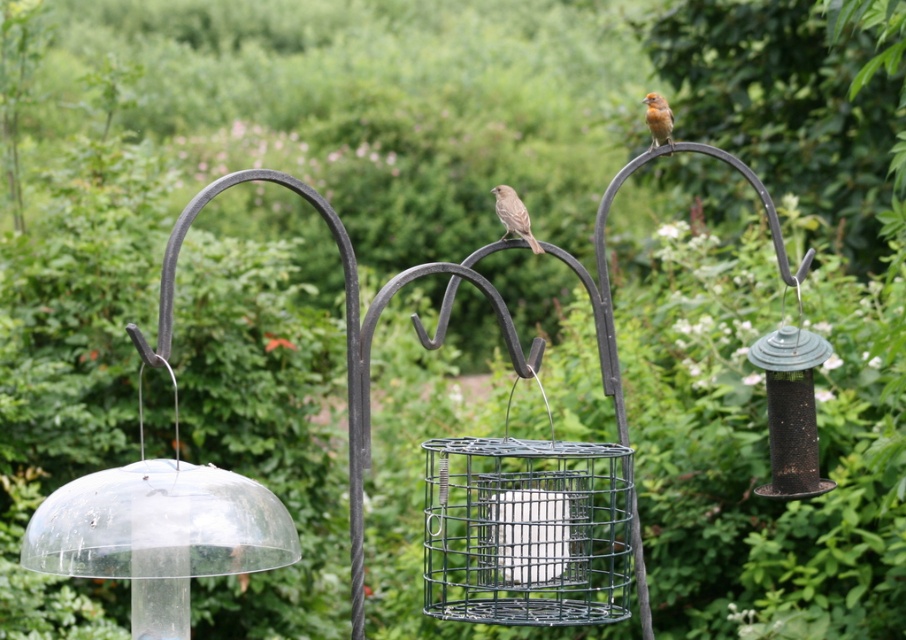
Consider the image. Who is lower down, wire mesh bird feeder at center or brown feathered bird at center?

wire mesh bird feeder at center

Does wire mesh bird feeder at center have a lesser height compared to brown feathered bird at center?

No.

From the picture: Who is more forward, (593, 557) or (529, 237)?

Point (593, 557)

Where is `wire mesh bird feeder at center`? This screenshot has height=640, width=906. wire mesh bird feeder at center is located at coordinates (526, 529).

Measure the distance from brown feathered bird at center to brown speckled feathers at upper right.

brown feathered bird at center is 12.52 inches away from brown speckled feathers at upper right.

Between point (496, 212) and point (667, 104), which one is positioned behind?

Point (667, 104)

Is point (516, 221) positioned behind point (647, 113)?

No, it is not.

At what (x,y) coordinates should I click in order to perform the action: click on brown feathered bird at center. Please return your answer as a coordinate pair (x, y). Looking at the image, I should click on (513, 216).

Can you confirm if wire mesh bird feeder at center is positioned to the right of brown speckled feathers at upper right?

In fact, wire mesh bird feeder at center is to the left of brown speckled feathers at upper right.

Which is in front, point (560, 582) or point (667, 118)?

Point (560, 582)

What are the coordinates of `wire mesh bird feeder at center` in the screenshot? It's located at [x=526, y=529].